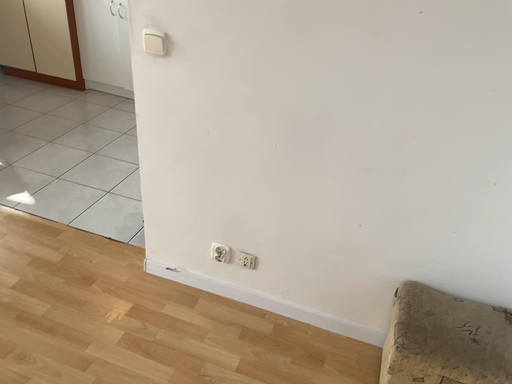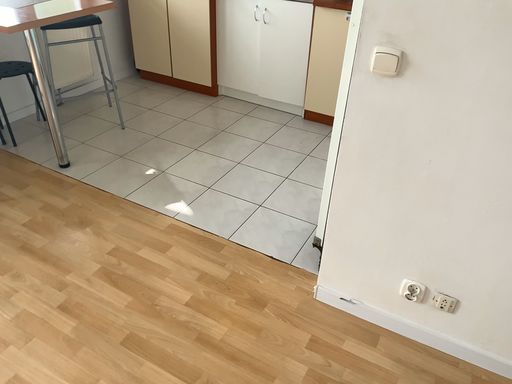
Question: How did the camera likely rotate when shooting the video?

Choices:
 (A) rotated left
 (B) rotated right

Answer: (A)